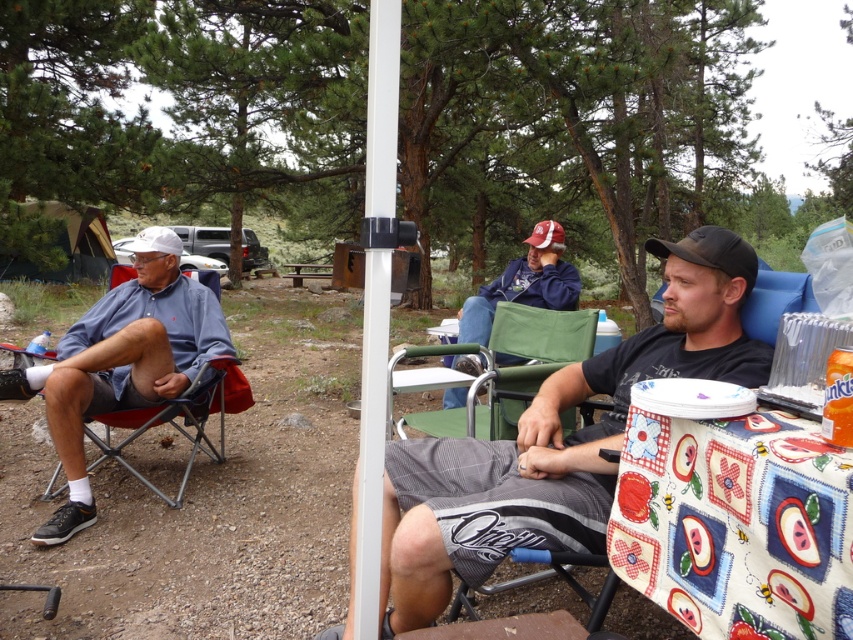
You are a photographer setting up a tripod to capture the scene. The tripod requires a stable, flat surface that is lower than the dark gray shorts at center and higher than the floral cotton tablecloth at lower right. Is there a suitable surface available in the scene?

The dark gray shorts at center has a greater height compared to the floral cotton tablecloth at lower right, so the surface between them may be suitable. However, the scene description mentions the ground is rugged with dirt and small rocks, which might not provide a stable, flat surface. Check the area around the floral cotton tablecloth at lower right for a smoother spot.

Looking at this image, you are standing at the campsite and notice two items, the matte blue shirt at left and the green fabric chair at center. Which item is taller?

The matte blue shirt at left is much taller than the green fabric chair at center.